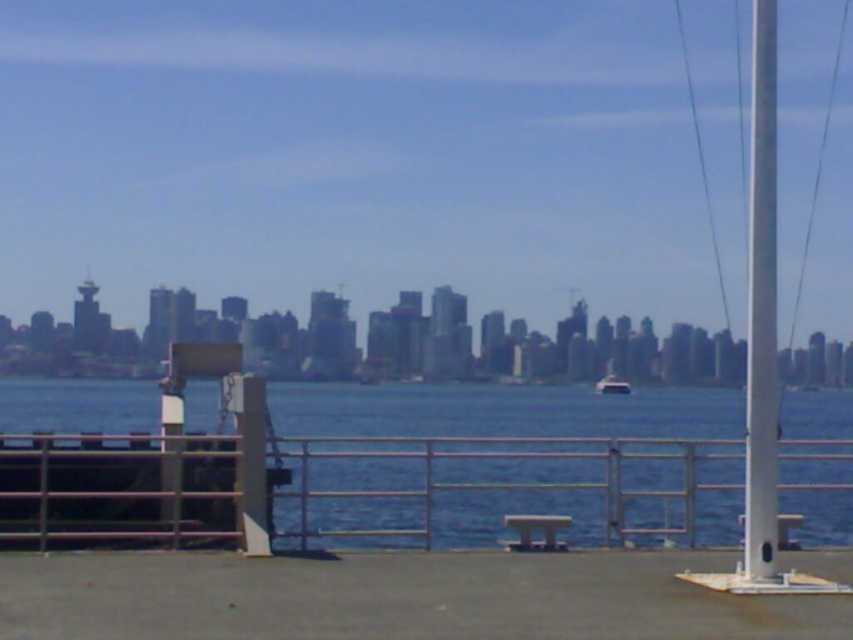
You are standing on the paved surface in the foreground and want to throw a frisbee to your friend who is standing at the edge of the blue water at center. If the maximum throwing distance you can achieve is 50 feet, will you be able to reach them?

The distance between you and the blue water at center is 47.48 feet, which is within your maximum throwing distance of 50 feet. Therefore, you should be able to reach your friend by throwing the frisbee.

You are standing at the waterfront promenade and want to know how far the point marked at coordinates (x=306, y=388) is from you. Can you determine the distance?

The distance between the point marked at coordinates (x=306, y=388) and the viewer is 149.73 meters.